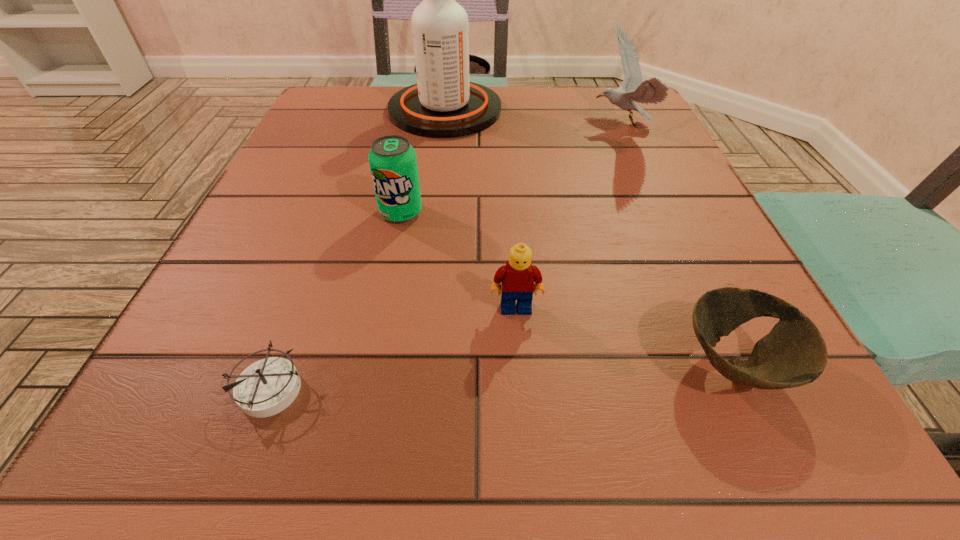
At what (x,y) coordinates should I click in order to perform the action: click on free space between the compass and the cleansing agent. Please return your answer as a coordinate pair (x, y). Looking at the image, I should click on (358, 249).

Identify the location of free area in between the compass and the cleansing agent. (358, 249).

The height and width of the screenshot is (540, 960). I want to click on vacant area that lies between the bowl and the pop soda, so click(x=567, y=288).

You are a GUI agent. You are given a task and a screenshot of the screen. Output one action in this format:
    pyautogui.click(x=<x>, y=<y>)
    Task: Click on the free space between the fifth shortest object and the shortest object
    
    Given the screenshot: What is the action you would take?
    pyautogui.click(x=445, y=257)

In order to click on vacant area between the shortest object and the cleansing agent in this screenshot , I will do `click(358, 249)`.

At what (x,y) coordinates should I click in order to perform the action: click on empty location between the fourth farthest object and the cleansing agent. Please return your answer as a coordinate pair (x, y). The height and width of the screenshot is (540, 960). Looking at the image, I should click on point(480,209).

Locate an element on the screen. This screenshot has width=960, height=540. free spot between the second shortest object and the compass is located at coordinates (502, 376).

This screenshot has height=540, width=960. I want to click on unoccupied position between the fourth farthest object and the third farthest object, so click(458, 260).

Identify the location of object that stands as the fifth closest to the compass. Image resolution: width=960 pixels, height=540 pixels. (652, 91).

Where is `the third closest object to the bowl`? The image size is (960, 540). the third closest object to the bowl is located at coordinates (393, 164).